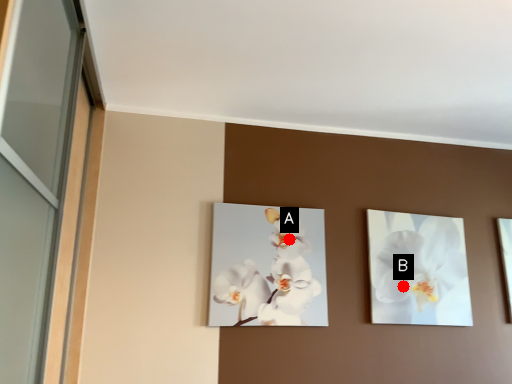
Question: Two points are circled on the image, labeled by A and B beside each circle. Which point is farther to the camera?

Choices:
 (A) A is further
 (B) B is further

Answer: (B)